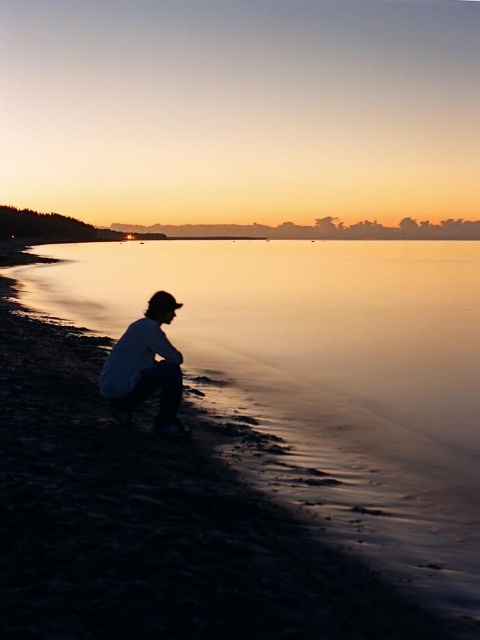
You are standing at the shoreline in the sunset scene and want to walk to the silky smooth water at center. According to the coordinates provided, in which direction should you move relative to your current position?

The silky smooth water at center is located at coordinates point (299, 321). Since you are at the shoreline, which is the edge of the water, you should move forward towards the center of the water to reach it.